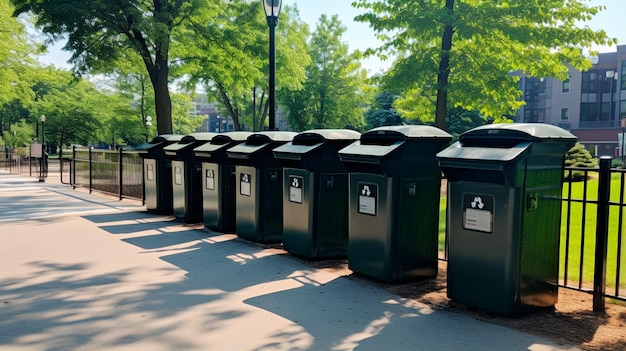
Find the location of a particular element. The width and height of the screenshot is (626, 351). lids on the trash cans is located at coordinates (166, 136), (203, 138), (231, 135), (270, 133), (329, 133), (409, 132), (534, 132).